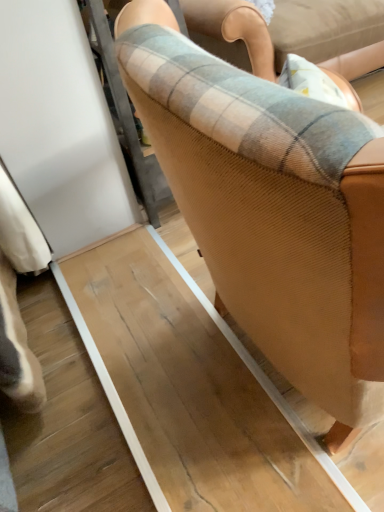
Where is `plaid fabric at center`? The width and height of the screenshot is (384, 512). plaid fabric at center is located at coordinates (244, 106).

This screenshot has width=384, height=512. What do you see at coordinates (244, 106) in the screenshot?
I see `plaid fabric at center` at bounding box center [244, 106].

This screenshot has height=512, width=384. What do you see at coordinates (289, 261) in the screenshot?
I see `brown textured chair at center` at bounding box center [289, 261].

Locate an element on the screen. The image size is (384, 512). brown textured chair at center is located at coordinates (289, 261).

Locate an element on the screen. This screenshot has width=384, height=512. plaid fabric at center is located at coordinates (244, 106).

Which object is positioned more to the right, plaid fabric at center or brown textured chair at center?

Positioned to the right is plaid fabric at center.

From the picture: Considering the positions of objects plaid fabric at center and brown textured chair at center in the image provided, who is in front, plaid fabric at center or brown textured chair at center?

brown textured chair at center is in front.

Which is behind, point (194, 84) or point (367, 149)?

Point (194, 84)

From the image's perspective, relative to brown textured chair at center, is plaid fabric at center above or below?

plaid fabric at center is situated higher than brown textured chair at center in the image.

From a real-world perspective, between plaid fabric at center and brown textured chair at center, who is vertically higher?

brown textured chair at center.

Can you confirm if plaid fabric at center is thinner than brown textured chair at center?

No, plaid fabric at center is not thinner than brown textured chair at center.

Considering the sizes of objects plaid fabric at center and brown textured chair at center in the image provided, who is taller, plaid fabric at center or brown textured chair at center?

brown textured chair at center is taller.

Which of these two, plaid fabric at center or brown textured chair at center, is smaller?

brown textured chair at center.

Is plaid fabric at center completely or partially outside of brown textured chair at center?

plaid fabric at center is positioned outside brown textured chair at center.

Are plaid fabric at center and brown textured chair at center beside each other?

No, plaid fabric at center is not beside brown textured chair at center.

Is plaid fabric at center oriented away from brown textured chair at center?

No, brown textured chair at center is not at the back of plaid fabric at center.

What's the angular difference between plaid fabric at center and brown textured chair at center's facing directions?

plaid fabric at center and brown textured chair at center are facing 88.9 degrees away from each other.

How far apart are plaid fabric at center and brown textured chair at center?

plaid fabric at center is 21.06 centimeters from brown textured chair at center.

Identify the location of chair lying on the left of plaid fabric at center. (289, 261).

Which object is positioned more to the right, brown textured chair at center or plaid fabric at center?

Positioned to the right is plaid fabric at center.

Relative to plaid fabric at center, is brown textured chair at center in front or behind?

brown textured chair at center is in front of plaid fabric at center.

Does point (333, 452) lie behind point (174, 34)?

That is True.

From the image's perspective, would you say brown textured chair at center is positioned over plaid fabric at center?

Incorrect, from the image's perspective, brown textured chair at center is lower than plaid fabric at center.

From a real-world perspective, does brown textured chair at center sit lower than plaid fabric at center?

No, from a real-world perspective, brown textured chair at center is not under plaid fabric at center.

Is brown textured chair at center wider or thinner than plaid fabric at center?

Considering their sizes, brown textured chair at center looks slimmer than plaid fabric at center.

From their relative heights in the image, would you say brown textured chair at center is taller or shorter than plaid fabric at center?

Considering their sizes, brown textured chair at center has more height than plaid fabric at center.

Considering the sizes of objects brown textured chair at center and plaid fabric at center in the image provided, who is smaller, brown textured chair at center or plaid fabric at center?

brown textured chair at center.

Is brown textured chair at center surrounding plaid fabric at center?

No, brown textured chair at center does not contain plaid fabric at center.

Can you see brown textured chair at center touching plaid fabric at center?

No, brown textured chair at center is not in contact with plaid fabric at center.

Is brown textured chair at center aimed at plaid fabric at center?

No, brown textured chair at center does not turn towards plaid fabric at center.

How many degrees apart are the facing directions of brown textured chair at center and plaid fabric at center?

88.9 degrees.

At what (x,y) coordinates should I click in order to perform the action: click on plaid that is under the brown textured chair at center (from a real-world perspective). Please return your answer as a coordinate pair (x, y). The image size is (384, 512). Looking at the image, I should click on (244, 106).

Where is `plaid that is behind the brown textured chair at center`? plaid that is behind the brown textured chair at center is located at coordinates (244, 106).

In the image, there is a brown textured chair at center. At what (x,y) coordinates should I click in order to perform the action: click on plaid above it (from the image's perspective). Please return your answer as a coordinate pair (x, y). Looking at the image, I should click on (244, 106).